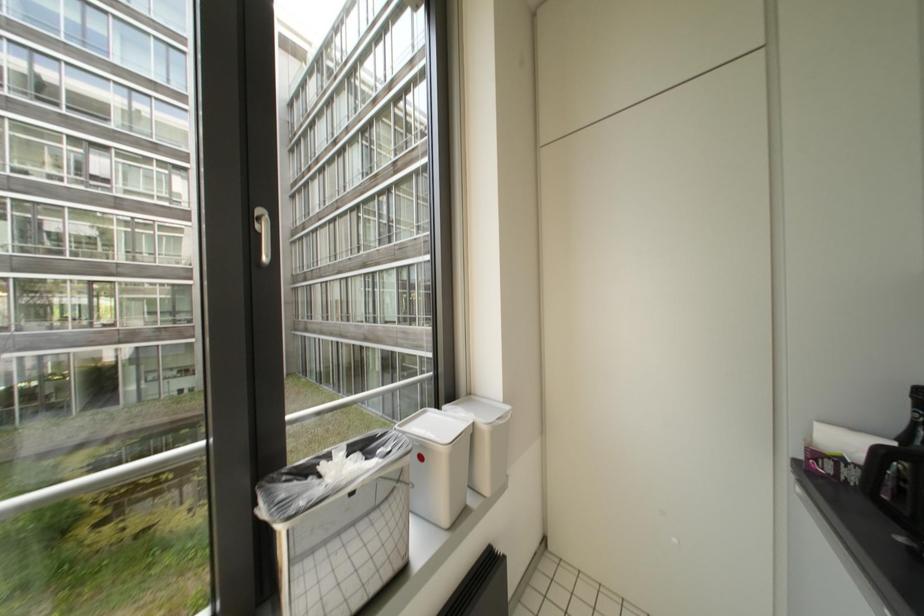
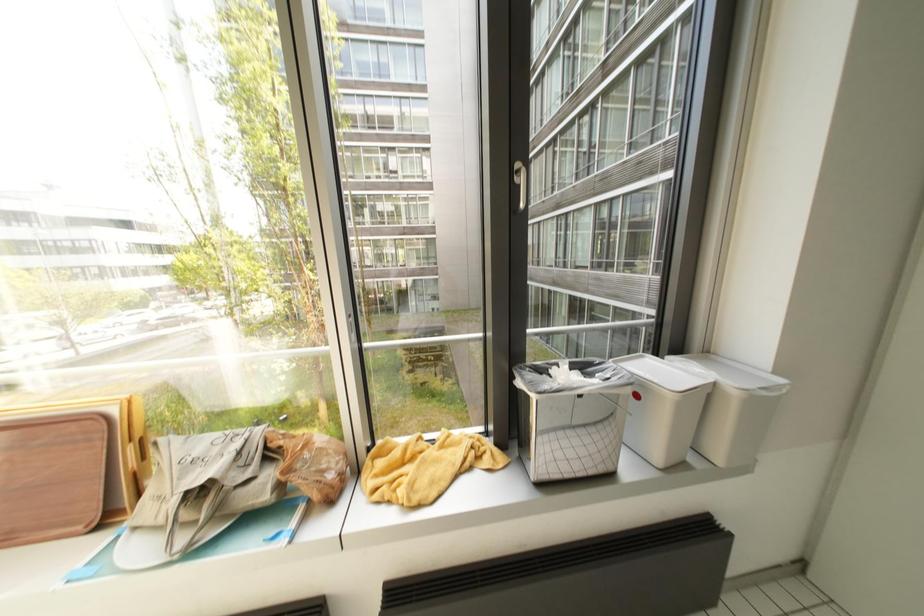
Question: The camera is either moving clockwise (left) or counter-clockwise (right) around the object. The first image is from the beginning of the video and the second image is from the end. Is the camera moving left or right when shooting the video?

Choices:
 (A) Left
 (B) Right

Answer: (B)